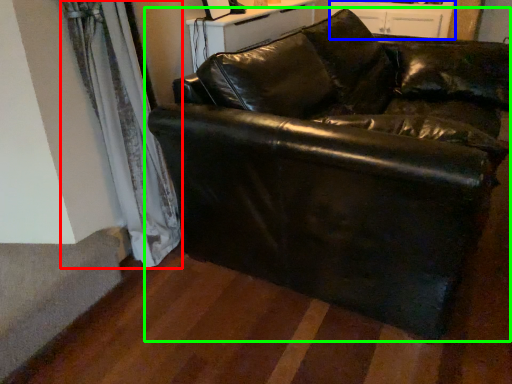
Question: Which object is positioned closest to curtain (highlighted by a red box)? Select from dresser (highlighted by a blue box) and studio couch (highlighted by a green box).

Choices:
 (A) dresser
 (B) studio couch

Answer: (B)